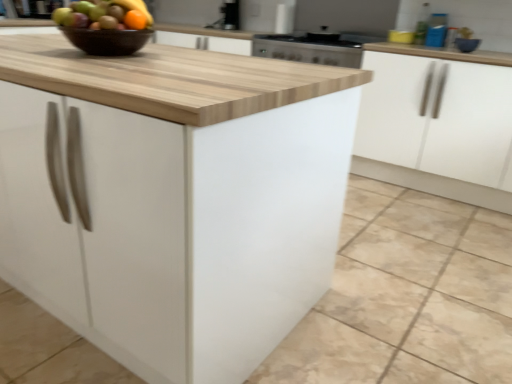
What do you see at coordinates (173, 198) in the screenshot? I see `white matte cabinet at center, the second cabinetry positioned from the back` at bounding box center [173, 198].

Describe the element at coordinates (106, 40) in the screenshot. I see `brown glossy bowl at upper center` at that location.

At what (x,y) coordinates should I click in order to perform the action: click on satin silver sink at upper center. Please return your answer as a coordinate pair (x, y). The height and width of the screenshot is (384, 512). Looking at the image, I should click on (227, 16).

Where is `white matte cabinet at center, the second cabinetry positioned from the back`? This screenshot has width=512, height=384. white matte cabinet at center, the second cabinetry positioned from the back is located at coordinates point(173,198).

From a real-world perspective, which is physically below, orange matte grapefruit at upper left or satin silver sink at upper center?

satin silver sink at upper center is physically lower.

From the image's perspective, would you say orange matte grapefruit at upper left is positioned over satin silver sink at upper center?

Incorrect, from the image's perspective, orange matte grapefruit at upper left is lower than satin silver sink at upper center.

Who is taller, orange matte grapefruit at upper left or satin silver sink at upper center?

Standing taller between the two is satin silver sink at upper center.

Is orange matte grapefruit at upper left oriented away from satin silver sink at upper center?

Correct, orange matte grapefruit at upper left is looking away from satin silver sink at upper center.

Which of these two, white matte cabinet at right, positioned as the 2th cabinetry in front-to-back order, or satin silver sink at upper center, stands shorter?

satin silver sink at upper center.

Looking at this image, can you confirm if white matte cabinet at right, placed as the first cabinetry when sorted from back to front, is smaller than satin silver sink at upper center?

Actually, white matte cabinet at right, placed as the first cabinetry when sorted from back to front, might be larger than satin silver sink at upper center.

Between point (472, 73) and point (222, 19), which one is positioned in front?

Point (472, 73)

Is white matte cabinet at right, positioned as the 2th cabinetry in front-to-back order, thinner than satin silver sink at upper center?

Incorrect, the width of white matte cabinet at right, positioned as the 2th cabinetry in front-to-back order, is not less than that of satin silver sink at upper center.

Can you tell me how much stainless steel oven at upper center and satin silver sink at upper center differ in facing direction?

2.22 degrees separate the facing orientations of stainless steel oven at upper center and satin silver sink at upper center.

Which is closer to the camera, (258, 45) or (224, 18)?

Point (258, 45) is positioned closer to the camera compared to point (224, 18).

From a real-world perspective, is stainless steel oven at upper center located beneath satin silver sink at upper center?

Correct, in the physical world, stainless steel oven at upper center is lower than satin silver sink at upper center.

Which is in front, stainless steel oven at upper center or satin silver sink at upper center?

stainless steel oven at upper center is closer to the camera.

Would you say stainless steel oven at upper center is part of satin silver sink at upper center's contents?

No, stainless steel oven at upper center is not inside satin silver sink at upper center.

In the image, is satin silver sink at upper center on the left side or the right side of stainless steel oven at upper center?

satin silver sink at upper center is positioned on stainless steel oven at upper center's left side.

From a real-world perspective, is satin silver sink at upper center positioned over stainless steel oven at upper center based on gravity?

Correct, in the physical world, satin silver sink at upper center is higher than stainless steel oven at upper center.

Are satin silver sink at upper center and stainless steel oven at upper center beside each other?

No, satin silver sink at upper center is not with stainless steel oven at upper center.

Which of these two, stainless steel oven at upper center or blue glossy bowl at upper right, is wider?

stainless steel oven at upper center.

Is stainless steel oven at upper center completely or partially outside of blue glossy bowl at upper right?

That's correct, stainless steel oven at upper center is outside of blue glossy bowl at upper right.

Based on the photo, is white matte cabinet at right, positioned as the 2th cabinetry in front-to-back order, far away from orange matte grapefruit at upper left?

Yes, white matte cabinet at right, positioned as the 2th cabinetry in front-to-back order, and orange matte grapefruit at upper left are quite far apart.

How distant is white matte cabinet at right, placed as the first cabinetry when sorted from back to front, from orange matte grapefruit at upper left?

white matte cabinet at right, placed as the first cabinetry when sorted from back to front, is 6.31 feet from orange matte grapefruit at upper left.

Would you say white matte cabinet at right, positioned as the 2th cabinetry in front-to-back order, is inside or outside orange matte grapefruit at upper left?

white matte cabinet at right, positioned as the 2th cabinetry in front-to-back order, is not enclosed by orange matte grapefruit at upper left.

In the scene shown: Can you confirm if white matte cabinet at right, placed as the first cabinetry when sorted from back to front, is wider than orange matte grapefruit at upper left?

Correct, the width of white matte cabinet at right, placed as the first cabinetry when sorted from back to front, exceeds that of orange matte grapefruit at upper left.

Would you say blue glossy bowl at upper right is to the left or to the right of white matte cabinet at center, the second cabinetry positioned from the back, in the picture?

Based on their positions, blue glossy bowl at upper right is located to the right of white matte cabinet at center, the second cabinetry positioned from the back.

From a real-world perspective, which object rests below the other?

white matte cabinet at center, the second cabinetry positioned from the back, is physically lower.

Who is taller, blue glossy bowl at upper right or white matte cabinet at center, which is counted as the 1th cabinetry, starting from the front?

white matte cabinet at center, which is counted as the 1th cabinetry, starting from the front, is taller.

Does blue glossy bowl at upper right have a larger size compared to white matte cabinet at center, which is counted as the 1th cabinetry, starting from the front?

Actually, blue glossy bowl at upper right might be smaller than white matte cabinet at center, which is counted as the 1th cabinetry, starting from the front.

Find the location of a particular element. This screenshot has width=512, height=384. sink behind the orange matte grapefruit at upper left is located at coordinates (227, 16).

In order to click on the 2nd cabinetry directly beneath the satin silver sink at upper center (from a real-world perspective) in this screenshot , I will do pos(438,123).

Estimate the real-world distances between objects in this image. Which object is closer to orange matte grapefruit at upper left, stainless steel oven at upper center or satin silver sink at upper center?

stainless steel oven at upper center.

Based on their spatial positions, is brown glossy bowl at upper center or stainless steel oven at upper center closer to white matte cabinet at right, positioned as the 2th cabinetry in front-to-back order?

stainless steel oven at upper center is positioned closer to the anchor white matte cabinet at right, positioned as the 2th cabinetry in front-to-back order.

From the image, which object appears to be farther from brown glossy bowl at upper center, orange matte grapefruit at upper left or white matte cabinet at right, positioned as the 2th cabinetry in front-to-back order?

white matte cabinet at right, positioned as the 2th cabinetry in front-to-back order, is further to brown glossy bowl at upper center.

From the image, which object appears to be nearer to white matte cabinet at right, placed as the first cabinetry when sorted from back to front, stainless steel oven at upper center or orange matte grapefruit at upper left?

stainless steel oven at upper center is closer to white matte cabinet at right, placed as the first cabinetry when sorted from back to front.

Consider the image. When comparing their distances from orange matte grapefruit at upper left, does stainless steel oven at upper center or brown glossy bowl at upper center seem further?

Based on the image, stainless steel oven at upper center appears to be further to orange matte grapefruit at upper left.

Based on their spatial positions, is blue glossy bowl at upper right or white matte cabinet at right, placed as the first cabinetry when sorted from back to front, closer to orange matte grapefruit at upper left?

white matte cabinet at right, placed as the first cabinetry when sorted from back to front, lies closer to orange matte grapefruit at upper left than the other object.

Looking at the image, which one is located further to blue glossy bowl at upper right, brown glossy bowl at upper center or stainless steel oven at upper center?

Among the two, brown glossy bowl at upper center is located further to blue glossy bowl at upper right.

Based on their spatial positions, is brown glossy bowl at upper center or orange matte grapefruit at upper left further from satin silver sink at upper center?

Among the two, brown glossy bowl at upper center is located further to satin silver sink at upper center.

The width and height of the screenshot is (512, 384). Find the location of `grapefruit between brown glossy bowl at upper center and white matte cabinet at right, placed as the first cabinetry when sorted from back to front, from left to right`. grapefruit between brown glossy bowl at upper center and white matte cabinet at right, placed as the first cabinetry when sorted from back to front, from left to right is located at coordinates (105, 15).

Where is `kitchen appliance situated between orange matte grapefruit at upper left and white matte cabinet at right, placed as the first cabinetry when sorted from back to front, from left to right`? kitchen appliance situated between orange matte grapefruit at upper left and white matte cabinet at right, placed as the first cabinetry when sorted from back to front, from left to right is located at coordinates (313, 49).

The width and height of the screenshot is (512, 384). Find the location of `kitchen appliance located between brown glossy bowl at upper center and white matte cabinet at right, positioned as the 2th cabinetry in front-to-back order, in the left-right direction`. kitchen appliance located between brown glossy bowl at upper center and white matte cabinet at right, positioned as the 2th cabinetry in front-to-back order, in the left-right direction is located at coordinates (313, 49).

What are the coordinates of `glass bowl between white matte cabinet at center, the second cabinetry positioned from the back, and blue glossy bowl at upper right from front to back` in the screenshot? It's located at tap(106, 40).